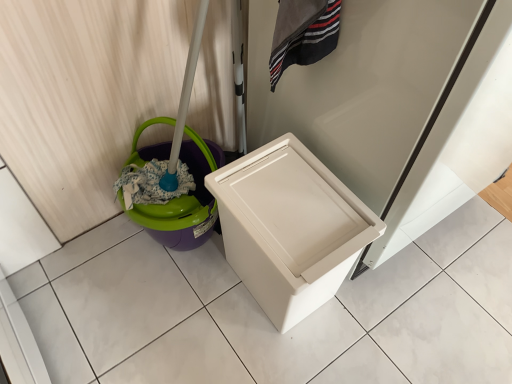
Question: Considering the relative positions of purple plastic potty at left and white plastic waste container at center in the image provided, is purple plastic potty at left in front of white plastic waste container at center?

Choices:
 (A) no
 (B) yes

Answer: (A)

Question: From the image's perspective, is purple plastic potty at left located beneath white plastic waste container at center?

Choices:
 (A) yes
 (B) no

Answer: (B)

Question: From the image's perspective, does purple plastic potty at left appear higher than white plastic waste container at center?

Choices:
 (A) yes
 (B) no

Answer: (A)

Question: Considering the relative sizes of purple plastic potty at left and white plastic waste container at center in the image provided, is purple plastic potty at left bigger than white plastic waste container at center?

Choices:
 (A) no
 (B) yes

Answer: (A)

Question: Is purple plastic potty at left aimed at white plastic waste container at center?

Choices:
 (A) yes
 (B) no

Answer: (A)

Question: Does purple plastic potty at left appear on the right side of white plastic waste container at center?

Choices:
 (A) no
 (B) yes

Answer: (A)

Question: Is purple plastic potty at left at the back of white plastic waste container at center?

Choices:
 (A) no
 (B) yes

Answer: (B)

Question: Could you tell me if white plastic waste container at center is facing purple plastic potty at left?

Choices:
 (A) yes
 (B) no

Answer: (B)

Question: Is white plastic waste container at center placed right next to purple plastic potty at left?

Choices:
 (A) no
 (B) yes

Answer: (A)

Question: Is white plastic waste container at center at the right side of purple plastic potty at left?

Choices:
 (A) no
 (B) yes

Answer: (B)

Question: Can you confirm if white plastic waste container at center is wider than purple plastic potty at left?

Choices:
 (A) no
 (B) yes

Answer: (B)

Question: Is white plastic waste container at center further to the viewer compared to purple plastic potty at left?

Choices:
 (A) yes
 (B) no

Answer: (B)

Question: Is point (207, 218) closer or farther from the camera than point (344, 241)?

Choices:
 (A) closer
 (B) farther

Answer: (B)